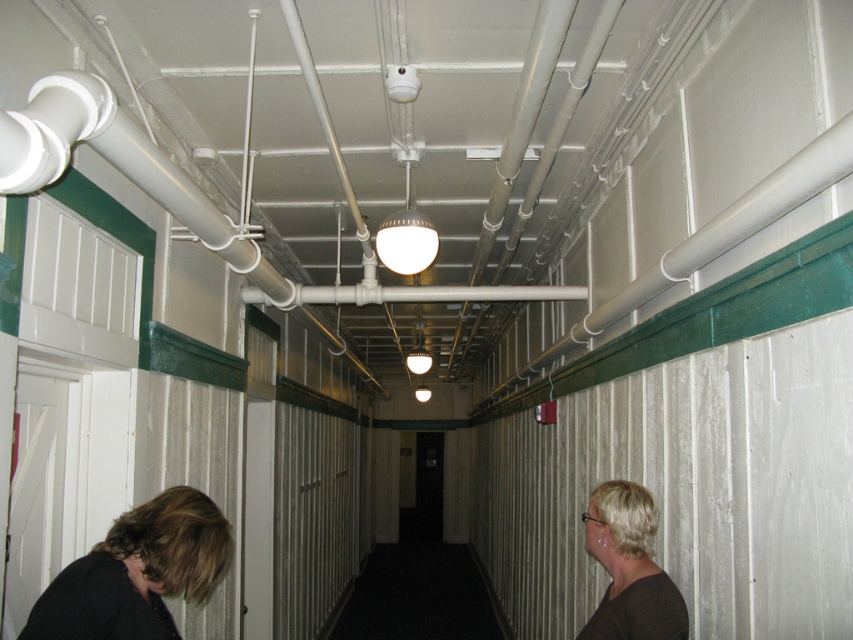
Can you confirm if dark brown hair at lower left is taller than blonde hair at right?

No.

Is dark brown hair at lower left wider than blonde hair at right?

Yes, dark brown hair at lower left is wider than blonde hair at right.

Which is in front, point (97, 545) or point (612, 540)?

Point (97, 545)

This screenshot has width=853, height=640. I want to click on dark brown hair at lower left, so pos(137,572).

Between white matte pipe at upper center and blonde hair at right, which one is positioned lower?

blonde hair at right is below.

Locate an element on the screen. This screenshot has height=640, width=853. white matte pipe at upper center is located at coordinates (708, 241).

I want to click on white matte pipe at upper center, so click(708, 241).

The width and height of the screenshot is (853, 640). I want to click on white matte pipe at upper center, so click(x=708, y=241).

Is white matte pipe at upper center smaller than black carpet at center?

Correct, white matte pipe at upper center occupies less space than black carpet at center.

Which is more to the left, white matte pipe at upper center or black carpet at center?

black carpet at center is more to the left.

Locate an element on the screen. The height and width of the screenshot is (640, 853). white matte pipe at upper center is located at coordinates (708, 241).